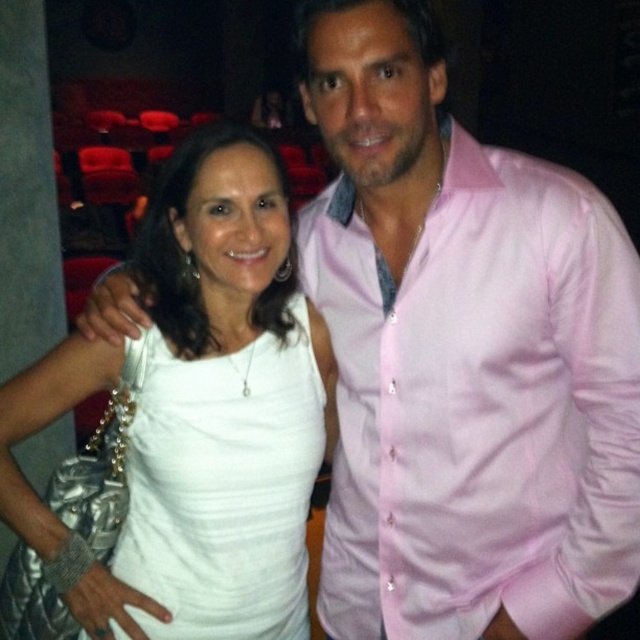
Is white satin dress at center positioned in front of white ribbed tank top at center?

Yes, it is.

Locate an element on the screen. The height and width of the screenshot is (640, 640). white satin dress at center is located at coordinates pyautogui.click(x=189, y=420).

Locate an element on the screen. This screenshot has width=640, height=640. white satin dress at center is located at coordinates point(189,420).